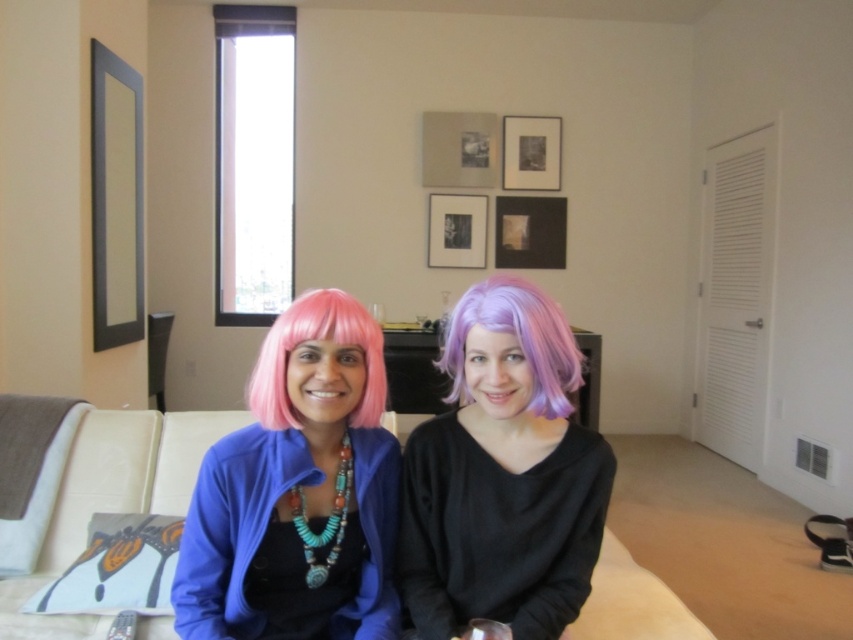
Can you confirm if purple matte wig at center is positioned above beige fabric couch at center?

Correct, purple matte wig at center is located above beige fabric couch at center.

Consider the image. Can you confirm if purple matte wig at center is taller than beige fabric couch at center?

Correct, purple matte wig at center is much taller as beige fabric couch at center.

Does point (412, 504) come behind point (677, 605)?

That is False.

Find the location of a particular element. purple matte wig at center is located at coordinates (503, 476).

Does beige fabric couch at center have a greater height compared to pink synthetic wig at center?

Correct, beige fabric couch at center is much taller as pink synthetic wig at center.

Is beige fabric couch at center thinner than pink synthetic wig at center?

No.

What do you see at coordinates (111, 499) in the screenshot? The image size is (853, 640). I see `beige fabric couch at center` at bounding box center [111, 499].

Identify the location of beige fabric couch at center. This screenshot has width=853, height=640. (111, 499).

Does pink matte wig at center have a smaller size compared to purple matte wig at center?

Yes.

In the scene shown: Is pink matte wig at center closer to camera compared to purple matte wig at center?

Yes.

Is point (302, 524) in front of point (492, 307)?

No, (302, 524) is further to viewer.

Locate an element on the screen. The image size is (853, 640). pink matte wig at center is located at coordinates (299, 492).